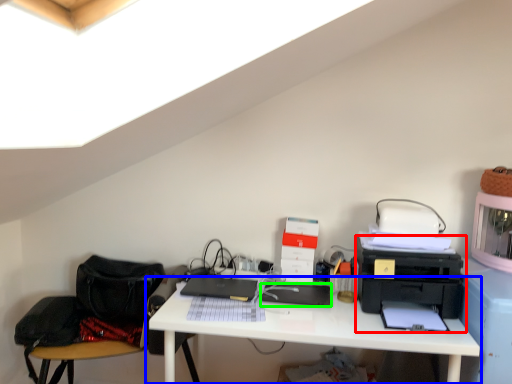
Question: Considering the real-world distances, which object is closest to printer (highlighted by a red box)? desk (highlighted by a blue box) or register (highlighted by a green box).

Choices:
 (A) desk
 (B) register

Answer: (A)